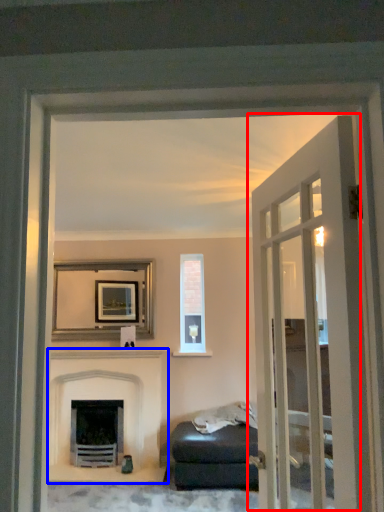
Question: Which of the following is the closest to the observer, door (highlighted by a red box) or fireplace (highlighted by a blue box)?

Choices:
 (A) door
 (B) fireplace

Answer: (A)